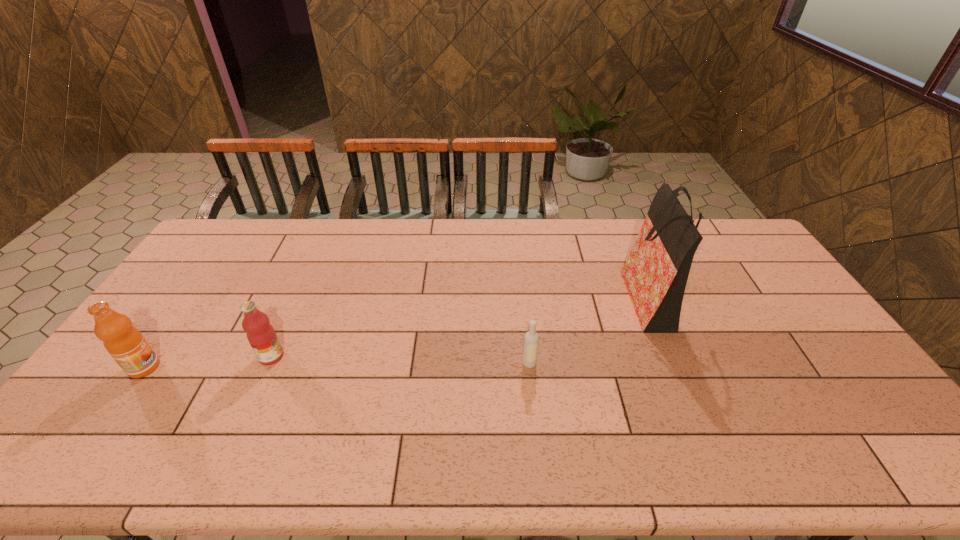
Locate an element on the screen. This screenshot has height=540, width=960. free location located 0.120m on the label side of the left fruit juice is located at coordinates (203, 368).

Locate an element on the screen. vacant space located on the label of the right fruit juice is located at coordinates (301, 357).

Locate an element on the screen. free space located 0.200m on the front of the shortest object is located at coordinates (537, 436).

Identify the location of object present at the left edge. This screenshot has width=960, height=540. (124, 342).

The image size is (960, 540). I want to click on free space at the far edge of the desktop, so click(492, 234).

The height and width of the screenshot is (540, 960). In order to click on free space at the near edge of the desktop in this screenshot , I will do `click(526, 440)`.

The height and width of the screenshot is (540, 960). In the image, there is a desktop. In order to click on free space at the left edge in this screenshot , I will do `click(150, 321)`.

The width and height of the screenshot is (960, 540). Identify the location of vacant space at the right edge of the desktop. (827, 336).

This screenshot has width=960, height=540. What are the coordinates of `vacant space that is in between the second shortest object and the leftmost object` in the screenshot? It's located at (207, 362).

Find the location of `free space between the shopping bag and the vodka`. free space between the shopping bag and the vodka is located at coordinates (588, 329).